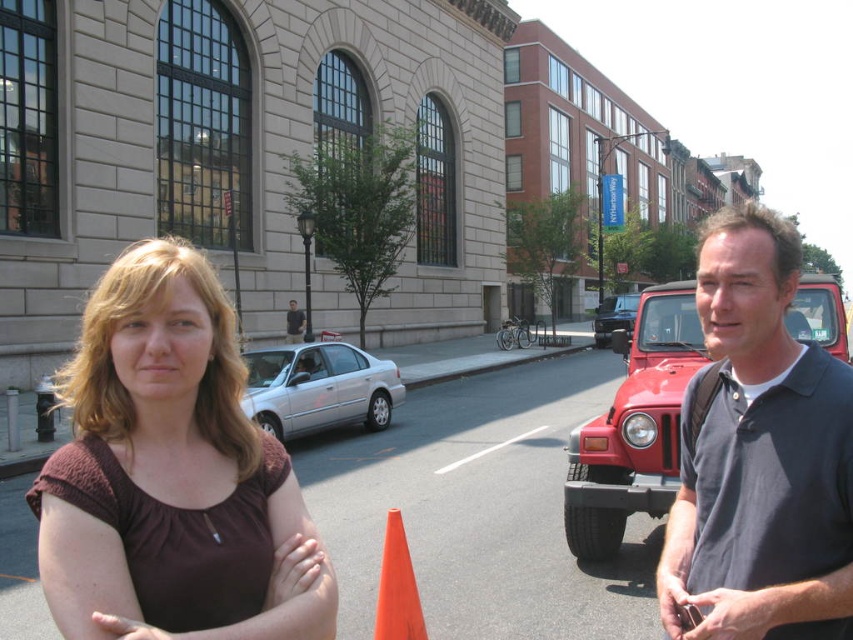
Based on the photo, can you confirm if brown fabric shirt at center is smaller than metallic red car at center?

Indeed, brown fabric shirt at center has a smaller size compared to metallic red car at center.

Which is more to the right, brown fabric shirt at center or metallic red car at center?

From the viewer's perspective, metallic red car at center appears more on the right side.

Find the location of a particular element. This screenshot has height=640, width=853. brown fabric shirt at center is located at coordinates (167, 472).

Is satin silver sedan at center further to camera compared to orange matte traffic cone at center?

Yes, it is behind orange matte traffic cone at center.

Between satin silver sedan at center and orange matte traffic cone at center, which one appears on the right side from the viewer's perspective?

Positioned to the right is orange matte traffic cone at center.

Locate an element on the screen. The height and width of the screenshot is (640, 853). satin silver sedan at center is located at coordinates (318, 387).

Who is lower down, orange matte traffic cone at center or metallic red car at center?

orange matte traffic cone at center is below.

Between point (387, 602) and point (610, 310), which one is positioned in front?

Point (387, 602) is in front.

Does point (376, 609) lie behind point (630, 296)?

No, it is in front of (630, 296).

Identify the location of orange matte traffic cone at center. (397, 588).